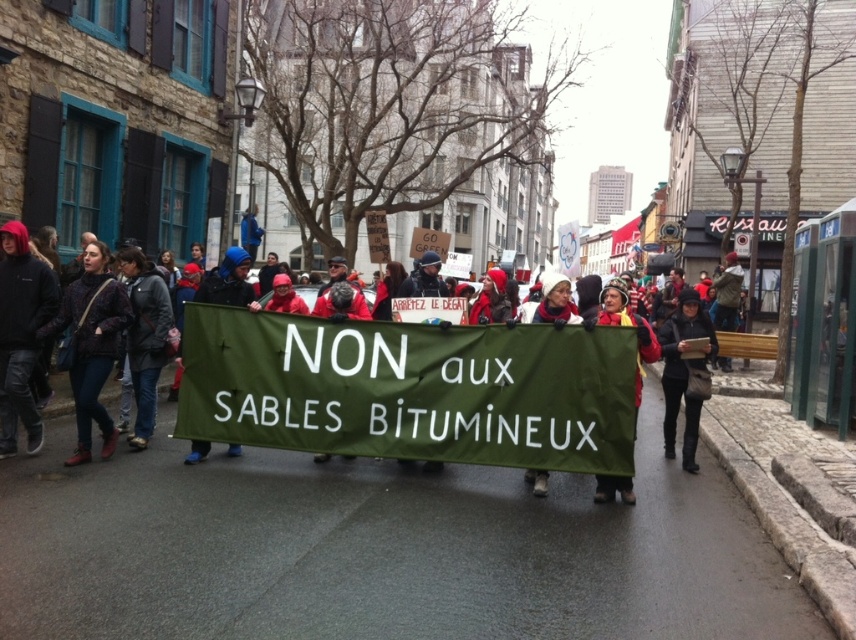
Is green fabric banner at center above matte green banner at center?

No.

Does point (294, 436) lie in front of point (548, 296)?

That is False.

This screenshot has height=640, width=856. Identify the location of green fabric banner at center. (413, 388).

Does black leather jacket at center have a lesser width compared to blue knit hat at center?

Yes, black leather jacket at center is thinner than blue knit hat at center.

Who is more distant from viewer, [669,368] or [244,275]?

Point [669,368]

What are the coordinates of `black leather jacket at center` in the screenshot? It's located at (682, 372).

This screenshot has width=856, height=640. I want to click on black leather jacket at center, so pos(682,372).

Which is more to the right, patterned fabric jacket at left or red knitted hat at center?

red knitted hat at center is more to the right.

In the scene shown: Is patterned fabric jacket at left bigger than red knitted hat at center?

Incorrect, patterned fabric jacket at left is not larger than red knitted hat at center.

What do you see at coordinates (91, 344) in the screenshot? This screenshot has height=640, width=856. I see `patterned fabric jacket at left` at bounding box center [91, 344].

At what (x,y) coordinates should I click in order to perform the action: click on patterned fabric jacket at left. Please return your answer as a coordinate pair (x, y). Image resolution: width=856 pixels, height=640 pixels. Looking at the image, I should click on (91, 344).